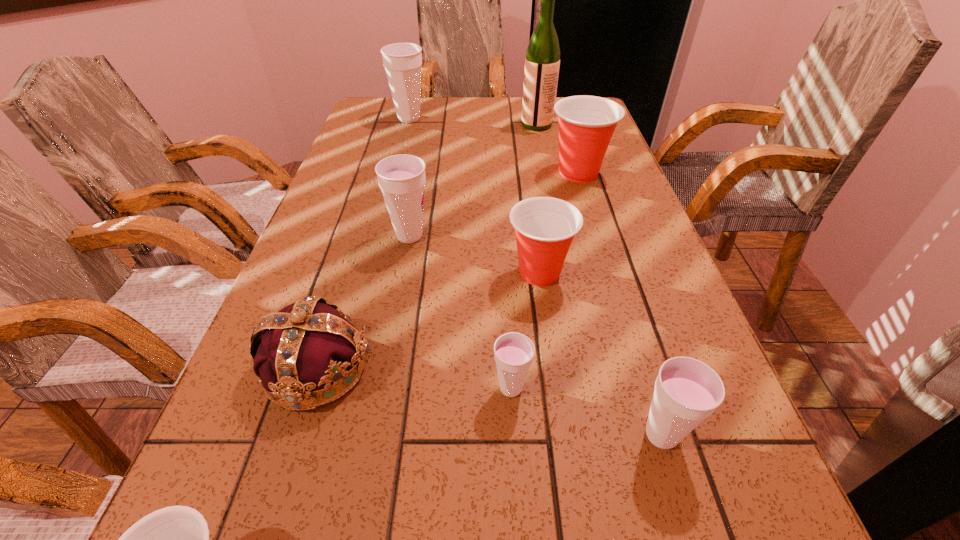
The width and height of the screenshot is (960, 540). What are the coordinates of `cup object that ranks as the fifth closest to the farthest purple cup` in the screenshot? It's located at (687, 391).

Locate an element on the screen. This screenshot has width=960, height=540. the fourth closest cup to the second nearest purple cup is located at coordinates (175, 539).

Find the location of `purple cup that stands as the fourth closest to the seventh nearest object`. purple cup that stands as the fourth closest to the seventh nearest object is located at coordinates (687, 391).

Identify the location of purple cup that is the third nearest to the third biggest purple cup. This screenshot has width=960, height=540. (402, 61).

Choose which red cup is the second nearest neighbor to the farthest purple cup. Please provide its 2D coordinates. Your answer should be formatted as a tuple, i.e. [(x, y)], where the tuple contains the x and y coordinates of a point satisfying the conditions above.

[(544, 226)]

Where is `red cup that stands as the second closest to the fifth farthest cup`? This screenshot has height=540, width=960. red cup that stands as the second closest to the fifth farthest cup is located at coordinates (175, 539).

You are a GUI agent. You are given a task and a screenshot of the screen. Output one action in this format:
    pyautogui.click(x=<x>, y=<y>)
    Task: Click on the vacant region that satisfies the following two spatial constraints: 1. on the label of the tallest object; 2. on the front side of the fifth farthest cup
    The image size is (960, 540).
    Given the screenshot: What is the action you would take?
    pyautogui.click(x=591, y=388)

Image resolution: width=960 pixels, height=540 pixels. Find the location of `vacant region that satisfies the following two spatial constraints: 1. on the front side of the nearest purple cup; 2. on the left side of the smallest purple cup`. vacant region that satisfies the following two spatial constraints: 1. on the front side of the nearest purple cup; 2. on the left side of the smallest purple cup is located at coordinates click(514, 435).

You are a GUI agent. You are given a task and a screenshot of the screen. Output one action in this format:
    pyautogui.click(x=<x>, y=<y>)
    Task: Click on the free space that satisfies the following two spatial constraints: 1. on the label of the sixth farthest cup; 2. on the right side of the green liquor
    Image resolution: width=960 pixels, height=540 pixels.
    Given the screenshot: What is the action you would take?
    pyautogui.click(x=601, y=435)